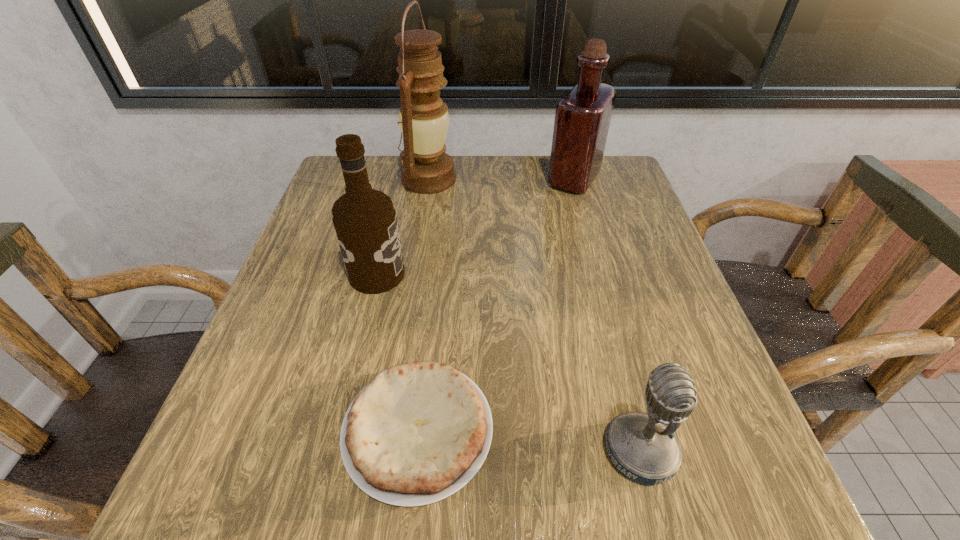
You are a GUI agent. You are given a task and a screenshot of the screen. Output one action in this format:
    pyautogui.click(x=<x>, y=<y>)
    Task: Click on the object located in the near right corner section of the desktop
    Image resolution: width=960 pixels, height=540 pixels.
    Given the screenshot: What is the action you would take?
    pyautogui.click(x=643, y=447)

The width and height of the screenshot is (960, 540). Find the location of `vacant area at the far edge of the desktop`. vacant area at the far edge of the desktop is located at coordinates (496, 187).

Image resolution: width=960 pixels, height=540 pixels. In the image, there is a desktop. What are the coordinates of `vacant space at the near edge` in the screenshot? It's located at (318, 499).

The image size is (960, 540). In the image, there is a desktop. Identify the location of vacant space at the left edge. (309, 285).

At what (x,y) coordinates should I click in order to perform the action: click on vacant space at the right edge of the desktop. Please return your answer as a coordinate pair (x, y). Looking at the image, I should click on (601, 238).

You are a GUI agent. You are given a task and a screenshot of the screen. Output one action in this format:
    pyautogui.click(x=<x>, y=<y>)
    Task: Click on the vacant space at the far left corner
    This screenshot has width=960, height=540.
    Given the screenshot: What is the action you would take?
    pyautogui.click(x=377, y=156)

In the image, there is a desktop. At what (x,y) coordinates should I click in order to perform the action: click on vacant area at the near left corner. Please return your answer as a coordinate pair (x, y). The width and height of the screenshot is (960, 540). Looking at the image, I should click on (238, 477).

Find the location of a particular element. The image size is (960, 540). free spot at the far right corner of the desktop is located at coordinates (631, 188).

This screenshot has height=540, width=960. What are the coordinates of `free space between the liquor and the second shortest object` in the screenshot? It's located at (607, 315).

Find the location of a particular element. This screenshot has height=540, width=960. vacant space in between the tortilla and the microphone is located at coordinates [x=529, y=441].